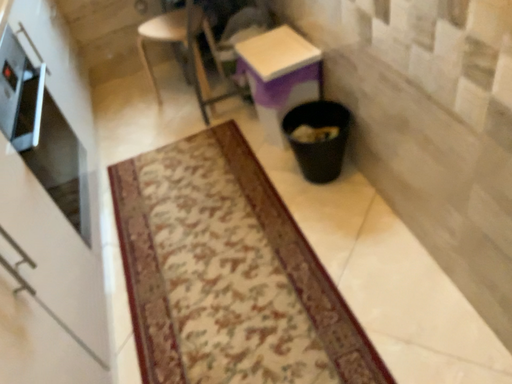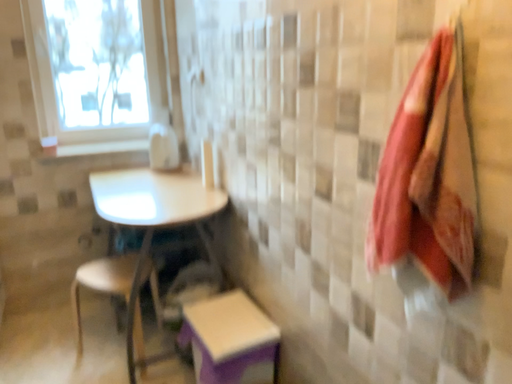
Question: Which way did the camera rotate in the video?

Choices:
 (A) rotated right
 (B) rotated left

Answer: (A)